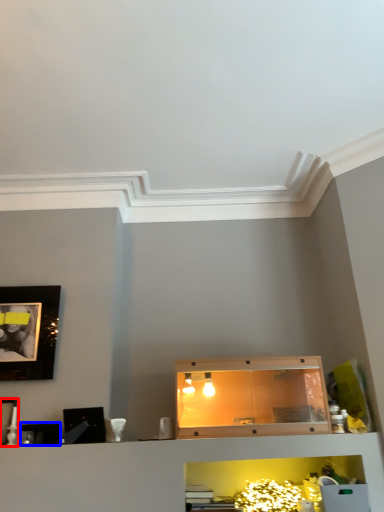
Question: Among these objects, which one is nearest to the camera, picture frame (highlighted by a red box) or picture frame (highlighted by a blue box)?

Choices:
 (A) picture frame
 (B) picture frame

Answer: (A)